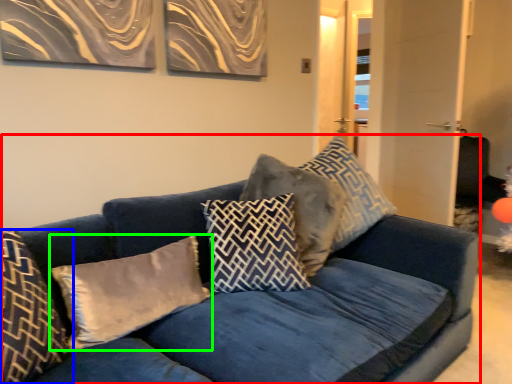
Question: Estimate the real-world distances between objects in this image. Which object is closer to studio couch (highlighted by a red box), pillow (highlighted by a blue box) or pillow (highlighted by a green box)?

Choices:
 (A) pillow
 (B) pillow

Answer: (B)